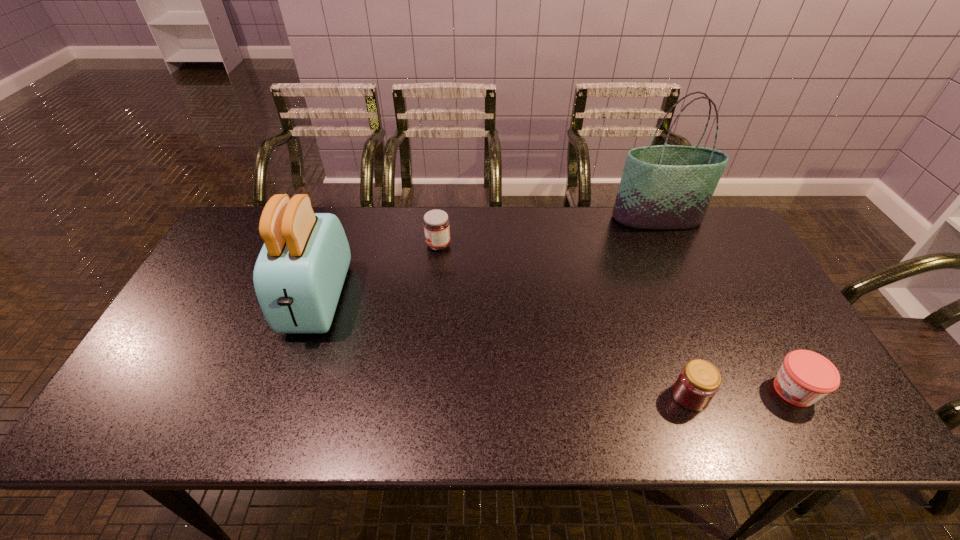
The width and height of the screenshot is (960, 540). I want to click on object located at the near right corner, so click(x=804, y=377).

Identify the location of vacant position at the far edge of the desktop. The image size is (960, 540). (340, 215).

I want to click on vacant space at the left edge of the desktop, so click(220, 335).

The height and width of the screenshot is (540, 960). Identify the location of vacant area at the right edge. (785, 352).

The height and width of the screenshot is (540, 960). In order to click on vacant area at the far right corner of the desktop in this screenshot , I will do `click(706, 235)`.

Find the location of a particular element. This screenshot has width=960, height=540. vacant region between the tallest object and the rightmost jam is located at coordinates (726, 305).

At what (x,y) coordinates should I click in order to perform the action: click on free space between the second jam from left to right and the rightmost jam. Please return your answer as a coordinate pair (x, y). The image size is (960, 540). Looking at the image, I should click on (742, 393).

Find the location of a particular element. This screenshot has width=960, height=540. empty space that is in between the tallest jam and the tote bag is located at coordinates (547, 232).

Identify the location of empty space between the fourth nearest object and the third farthest object. (377, 272).

I want to click on empty space between the leftmost object and the tote bag, so click(x=487, y=259).